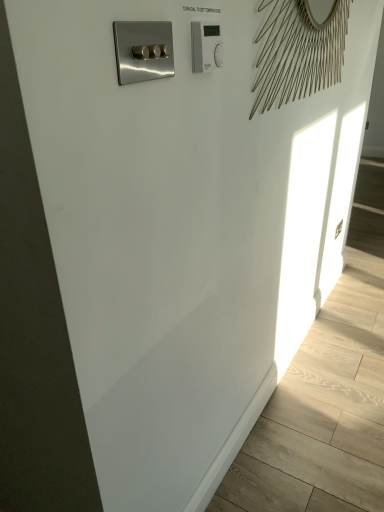
Question: Looking at their shapes, would you say satin nickel switch at upper left is wider or thinner than white plastic thermostat at upper right?

Choices:
 (A) thin
 (B) wide

Answer: (A)

Question: From a real-world perspective, is satin nickel switch at upper left positioned above or below white plastic thermostat at upper right?

Choices:
 (A) above
 (B) below

Answer: (B)

Question: Does point (135, 66) appear closer or farther from the camera than point (213, 38)?

Choices:
 (A) closer
 (B) farther

Answer: (A)

Question: Considering the positions of white plastic thermostat at upper right and satin nickel switch at upper left in the image, is white plastic thermostat at upper right wider or thinner than satin nickel switch at upper left?

Choices:
 (A) wide
 (B) thin

Answer: (A)

Question: In terms of size, does white plastic thermostat at upper right appear bigger or smaller than satin nickel switch at upper left?

Choices:
 (A) small
 (B) big

Answer: (A)

Question: Is white plastic thermostat at upper right to the left or to the right of satin nickel switch at upper left in the image?

Choices:
 (A) left
 (B) right

Answer: (B)

Question: From a real-world perspective, is white plastic thermostat at upper right above or below satin nickel switch at upper left?

Choices:
 (A) below
 (B) above

Answer: (B)